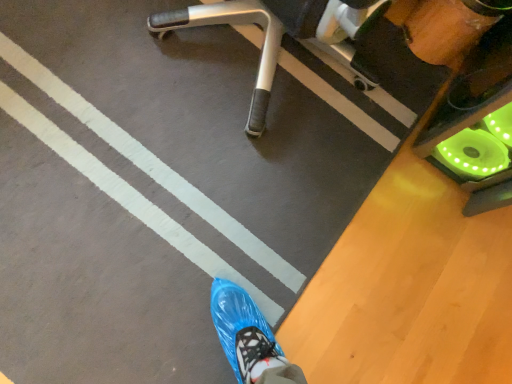
The image size is (512, 384). What do you see at coordinates (150, 164) in the screenshot? I see `matte plastic shoe cover at lower center` at bounding box center [150, 164].

You are a GUI agent. You are given a task and a screenshot of the screen. Output one action in this format:
    pyautogui.click(x=<x>, y=<y>)
    Task: Click on the matte plastic shoe cover at lower center
    The width and height of the screenshot is (512, 384).
    Given the screenshot: What is the action you would take?
    pyautogui.click(x=150, y=164)

Describe the element at coordinates (300, 38) in the screenshot. I see `metallic silver chair at upper center` at that location.

Image resolution: width=512 pixels, height=384 pixels. In order to click on metallic silver chair at upper center in this screenshot , I will do `click(300, 38)`.

This screenshot has height=384, width=512. What are the coordinates of `matte plastic shoe cover at lower center` in the screenshot? It's located at (150, 164).

Considering the relative positions of matte plastic shoe cover at lower center and metallic silver chair at upper center in the image provided, is matte plastic shoe cover at lower center to the left of metallic silver chair at upper center from the viewer's perspective?

Yes.

Which object is closer to the camera taking this photo, matte plastic shoe cover at lower center or metallic silver chair at upper center?

metallic silver chair at upper center.

Between point (84, 114) and point (360, 35), which one is positioned in front?

The point (84, 114) is closer to the camera.

From the image's perspective, which is above, matte plastic shoe cover at lower center or metallic silver chair at upper center?

metallic silver chair at upper center is shown above in the image.

From a real-world perspective, is matte plastic shoe cover at lower center located beneath metallic silver chair at upper center?

Yes, from a real-world perspective, matte plastic shoe cover at lower center is below metallic silver chair at upper center.

Can you confirm if matte plastic shoe cover at lower center is wider than metallic silver chair at upper center?

Correct, the width of matte plastic shoe cover at lower center exceeds that of metallic silver chair at upper center.

Consider the image. Is matte plastic shoe cover at lower center taller than metallic silver chair at upper center?

No, matte plastic shoe cover at lower center is not taller than metallic silver chair at upper center.

Can you confirm if matte plastic shoe cover at lower center is smaller than metallic silver chair at upper center?

Yes, matte plastic shoe cover at lower center is smaller than metallic silver chair at upper center.

Is matte plastic shoe cover at lower center inside or outside of metallic silver chair at upper center?

matte plastic shoe cover at lower center cannot be found inside metallic silver chair at upper center.

Is matte plastic shoe cover at lower center beside metallic silver chair at upper center?

No.

Is matte plastic shoe cover at lower center facing away from metallic silver chair at upper center?

No, matte plastic shoe cover at lower center is not facing away from metallic silver chair at upper center.

How different are the orientations of matte plastic shoe cover at lower center and metallic silver chair at upper center in degrees?

89.6 degrees.

How distant is matte plastic shoe cover at lower center from metallic silver chair at upper center?

matte plastic shoe cover at lower center and metallic silver chair at upper center are 56.10 centimeters apart from each other.

Locate an element on the screen. The width and height of the screenshot is (512, 384). strip below the metallic silver chair at upper center (from the image's perspective) is located at coordinates (150, 164).

Is metallic silver chair at upper center at the left side of matte plastic shoe cover at lower center?

Incorrect, metallic silver chair at upper center is not on the left side of matte plastic shoe cover at lower center.

Does metallic silver chair at upper center lie behind matte plastic shoe cover at lower center?

No, the depth of metallic silver chair at upper center is less than that of matte plastic shoe cover at lower center.

Is point (404, 62) closer or farther from the camera than point (254, 255)?

Point (404, 62) appears to be farther away from the viewer than point (254, 255).

From the image's perspective, between metallic silver chair at upper center and matte plastic shoe cover at lower center, who is located below?

matte plastic shoe cover at lower center appears lower in the image.

From a real-world perspective, is metallic silver chair at upper center beneath matte plastic shoe cover at lower center?

No.

Is metallic silver chair at upper center wider than matte plastic shoe cover at lower center?

Incorrect, the width of metallic silver chair at upper center does not surpass that of matte plastic shoe cover at lower center.

Can you confirm if metallic silver chair at upper center is shorter than matte plastic shoe cover at lower center?

No.

Who is bigger, metallic silver chair at upper center or matte plastic shoe cover at lower center?

With larger size is metallic silver chair at upper center.

Is metallic silver chair at upper center not inside matte plastic shoe cover at lower center?

Yes, metallic silver chair at upper center is located beyond the bounds of matte plastic shoe cover at lower center.

Would you consider metallic silver chair at upper center to be distant from matte plastic shoe cover at lower center?

They are positioned close to each other.

Is metallic silver chair at upper center positioned with its back to matte plastic shoe cover at lower center?

That's not correct — metallic silver chair at upper center is not looking away from matte plastic shoe cover at lower center.

How different are the orientations of metallic silver chair at upper center and matte plastic shoe cover at lower center in degrees?

89.6 degrees.

How far apart are metallic silver chair at upper center and matte plastic shoe cover at lower center?

The distance of metallic silver chair at upper center from matte plastic shoe cover at lower center is 22.09 inches.

In the image, there is a metallic silver chair at upper center. Where is `strip below it (from a real-world perspective)`? strip below it (from a real-world perspective) is located at coordinates (x=150, y=164).

The height and width of the screenshot is (384, 512). In order to click on furniture that appears above the matte plastic shoe cover at lower center (from a real-world perspective) in this screenshot , I will do tap(300, 38).

This screenshot has height=384, width=512. Find the location of `furniture above the matte plastic shoe cover at lower center (from the image's perspective)`. furniture above the matte plastic shoe cover at lower center (from the image's perspective) is located at coordinates (300, 38).